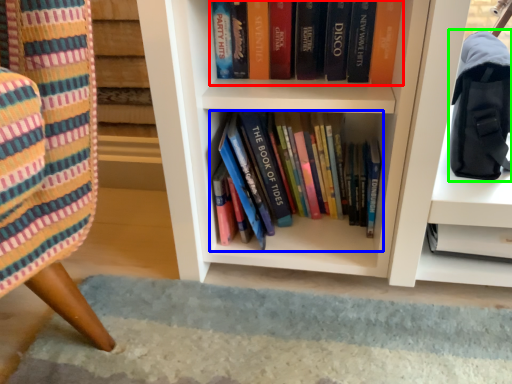
Question: Estimate the real-world distances between objects in this image. Which object is farther from book (highlighted by a red box), book (highlighted by a blue box) or shoulder bag (highlighted by a green box)?

Choices:
 (A) book
 (B) shoulder bag

Answer: (A)